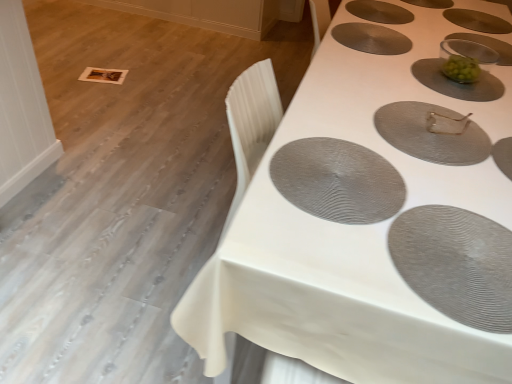
Locate an element on the screen. free point below gray textured placemat at lower right, arranged as the seventh oval when viewed from the back (from a real-world perspective) is located at coordinates (458, 240).